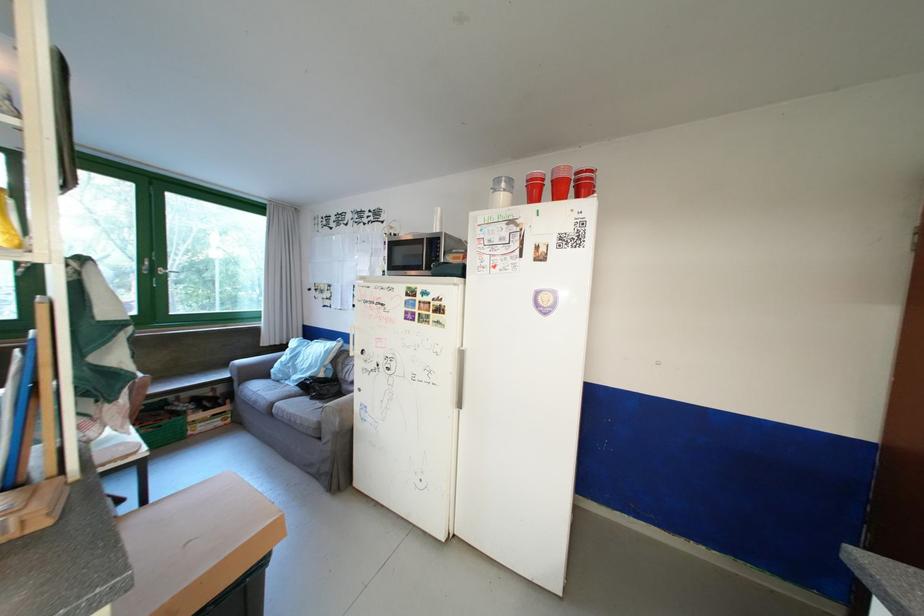
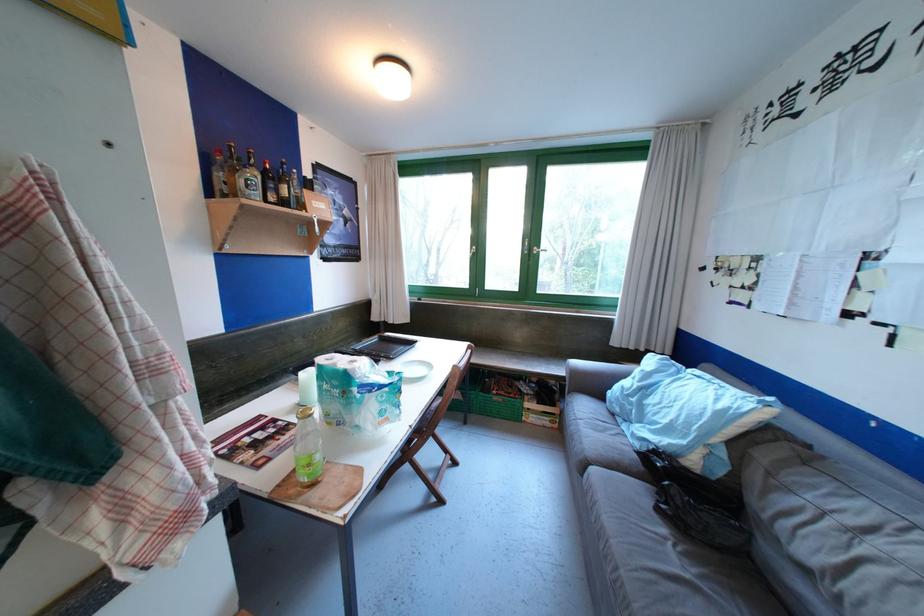
Locate, in the second image, the point that corresponds to (x=249, y=370) in the first image.

(581, 376)